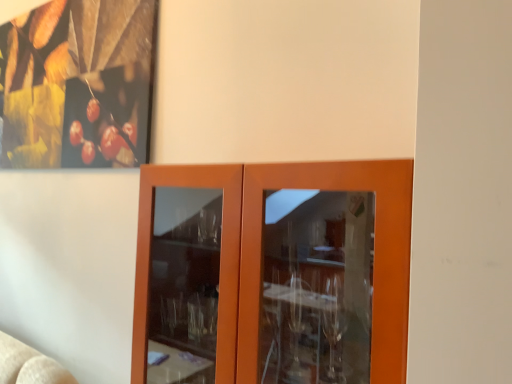
Describe the element at coordinates (259, 253) in the screenshot. This screenshot has height=384, width=512. I see `matte wood cupboard at center` at that location.

Measure the distance between point (x=390, y=258) and camera.

They are 31.06 inches apart.

This screenshot has width=512, height=384. In order to click on matte wood cupboard at center in this screenshot , I will do `click(259, 253)`.

Image resolution: width=512 pixels, height=384 pixels. Find the location of `matte wood cupboard at center`. matte wood cupboard at center is located at coordinates (259, 253).